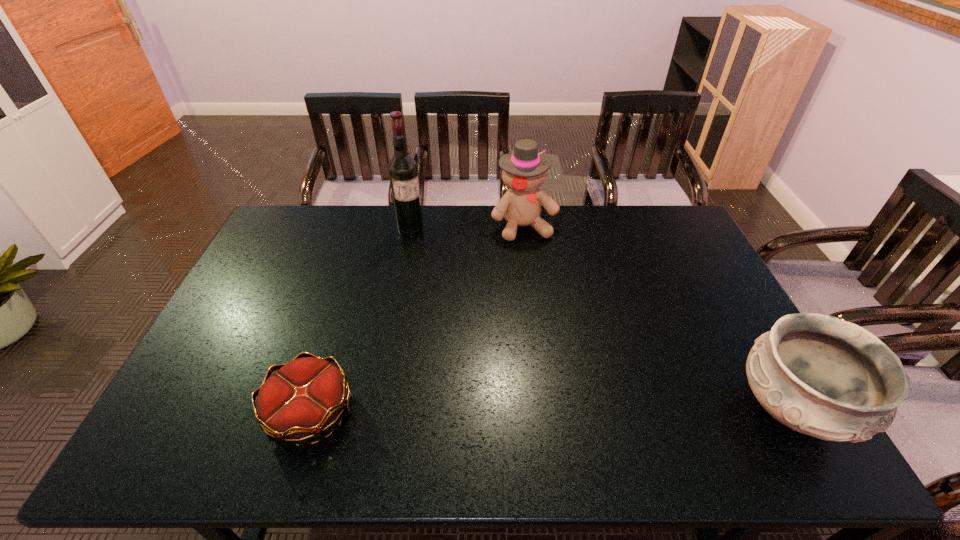
Identify the location of object that is at the right edge. The width and height of the screenshot is (960, 540). (821, 376).

At what (x,y) coordinates should I click in order to perform the action: click on object present at the near right corner. Please return your answer as a coordinate pair (x, y). The height and width of the screenshot is (540, 960). Looking at the image, I should click on (821, 376).

In the image, there is a desktop. At what (x,y) coordinates should I click in order to perform the action: click on vacant space at the far edge. Please return your answer as a coordinate pair (x, y). Image resolution: width=960 pixels, height=540 pixels. Looking at the image, I should click on (x=639, y=241).

The image size is (960, 540). What are the coordinates of `free spot at the near edge of the desktop` in the screenshot? It's located at click(407, 391).

I want to click on vacant area at the left edge, so click(x=261, y=246).

At what (x,y) coordinates should I click in order to perform the action: click on free spot at the far left corner of the desktop. Please return your answer as a coordinate pair (x, y). The height and width of the screenshot is (540, 960). Looking at the image, I should click on (304, 229).

What are the coordinates of `free space at the far right corner of the desktop` in the screenshot? It's located at (657, 214).

In the image, there is a desktop. Where is `vacant space at the near right corner`? The height and width of the screenshot is (540, 960). vacant space at the near right corner is located at coordinates (763, 417).

The width and height of the screenshot is (960, 540). Find the location of `free space that is in between the second shortest object and the rag_doll`. free space that is in between the second shortest object and the rag_doll is located at coordinates (658, 318).

The width and height of the screenshot is (960, 540). Identify the location of free space between the second shortest object and the third object from left to right. (658, 318).